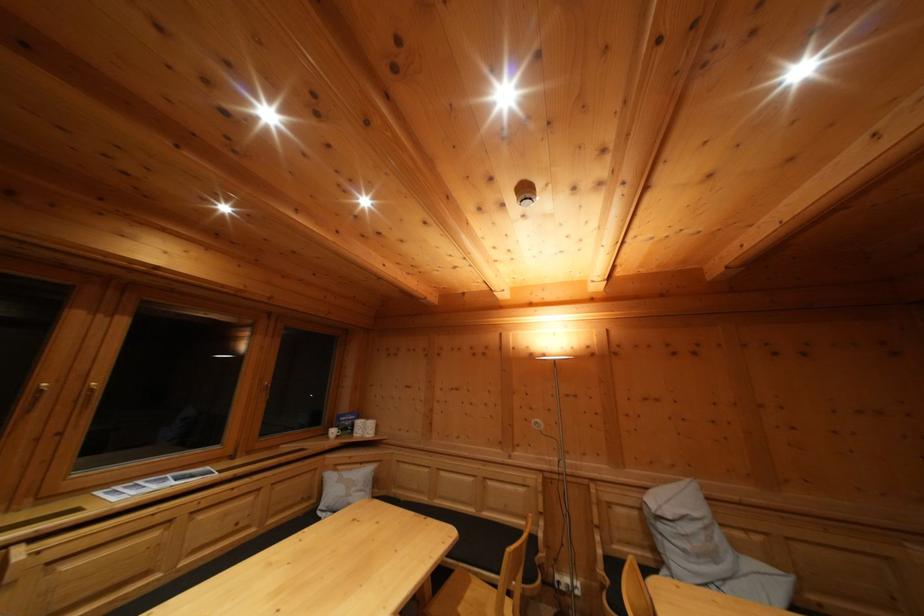
The location [345,488] corresponds to which object?

It refers to a grey pillow.